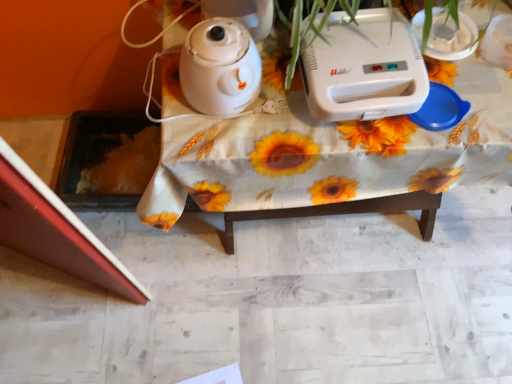
Question: Is white plastic table at center looking in the opposite direction of white glossy kettle at upper center?

Choices:
 (A) no
 (B) yes

Answer: (A)

Question: Considering the relative sizes of white plastic table at center and white glossy kettle at upper center in the image provided, is white plastic table at center bigger than white glossy kettle at upper center?

Choices:
 (A) no
 (B) yes

Answer: (B)

Question: Can you confirm if white plastic table at center is shorter than white glossy kettle at upper center?

Choices:
 (A) no
 (B) yes

Answer: (A)

Question: From the image's perspective, is white plastic table at center located above white glossy kettle at upper center?

Choices:
 (A) yes
 (B) no

Answer: (B)

Question: From a real-world perspective, is white plastic table at center below white glossy kettle at upper center?

Choices:
 (A) no
 (B) yes

Answer: (B)

Question: In terms of size, does white plastic table at center appear bigger or smaller than white glossy kettle at upper center?

Choices:
 (A) big
 (B) small

Answer: (A)

Question: Would you say white plastic table at center is to the left or to the right of white glossy kettle at upper center in the picture?

Choices:
 (A) right
 (B) left

Answer: (A)

Question: In terms of width, does white plastic table at center look wider or thinner when compared to white glossy kettle at upper center?

Choices:
 (A) wide
 (B) thin

Answer: (A)

Question: From the image's perspective, relative to white glossy kettle at upper center, is white plastic table at center above or below?

Choices:
 (A) above
 (B) below

Answer: (B)

Question: Is white glossy kettle at upper center in front of or behind white plastic table at center in the image?

Choices:
 (A) behind
 (B) front

Answer: (B)

Question: Looking at their shapes, would you say white glossy kettle at upper center is wider or thinner than white plastic table at center?

Choices:
 (A) wide
 (B) thin

Answer: (B)

Question: From a real-world perspective, is white glossy kettle at upper center physically located above or below white plastic table at center?

Choices:
 (A) above
 (B) below

Answer: (A)

Question: In the image, is white glossy kettle at upper center on the left side or the right side of white plastic table at center?

Choices:
 (A) left
 (B) right

Answer: (A)

Question: Based on their positions, is white plastic table at center located to the left or right of white plastic toaster at upper center?

Choices:
 (A) right
 (B) left

Answer: (A)

Question: Relative to white plastic toaster at upper center, is white plastic table at center in front or behind?

Choices:
 (A) behind
 (B) front

Answer: (A)